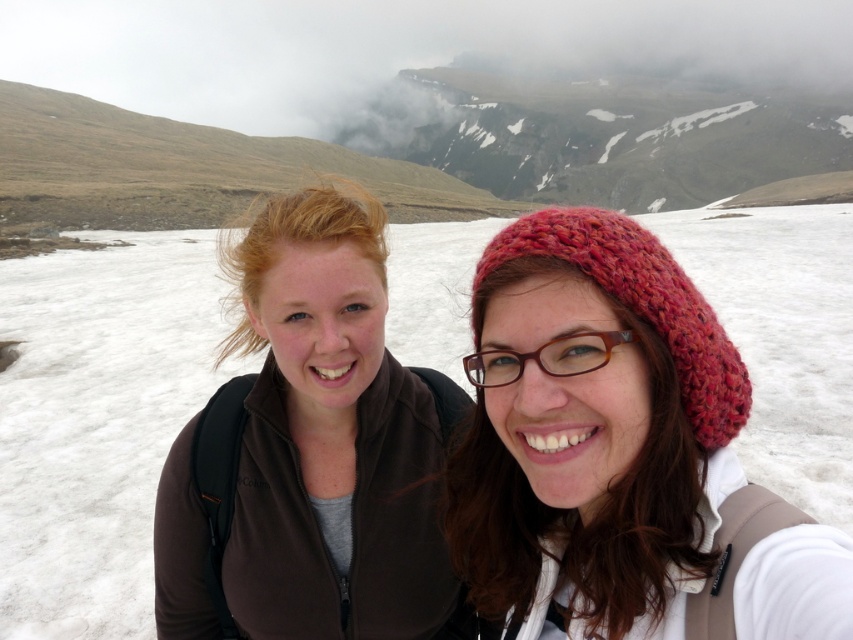
Question: Which of the following is the farthest from the observer?

Choices:
 (A) (477, 384)
 (B) (637, 275)

Answer: (A)

Question: Is knitted wool beret at center to the left of brown plastic glasses at center from the viewer's perspective?

Choices:
 (A) no
 (B) yes

Answer: (A)

Question: Estimate the real-world distances between objects in this image. Which object is closer to the knitted wool beret at center?

Choices:
 (A) white fluffy cloud at upper center
 (B) brown fleece jacket at center
 (C) white fluffy snow at center

Answer: (B)

Question: Can you confirm if brown fleece jacket at center is wider than white fluffy cloud at upper center?

Choices:
 (A) yes
 (B) no

Answer: (B)

Question: Which point is farther to the camera?

Choices:
 (A) (732, 381)
 (B) (463, 323)
 (C) (563, 353)
 (D) (225, 113)

Answer: (D)

Question: Is white fluffy cloud at upper center thinner than brown plastic glasses at center?

Choices:
 (A) no
 (B) yes

Answer: (A)